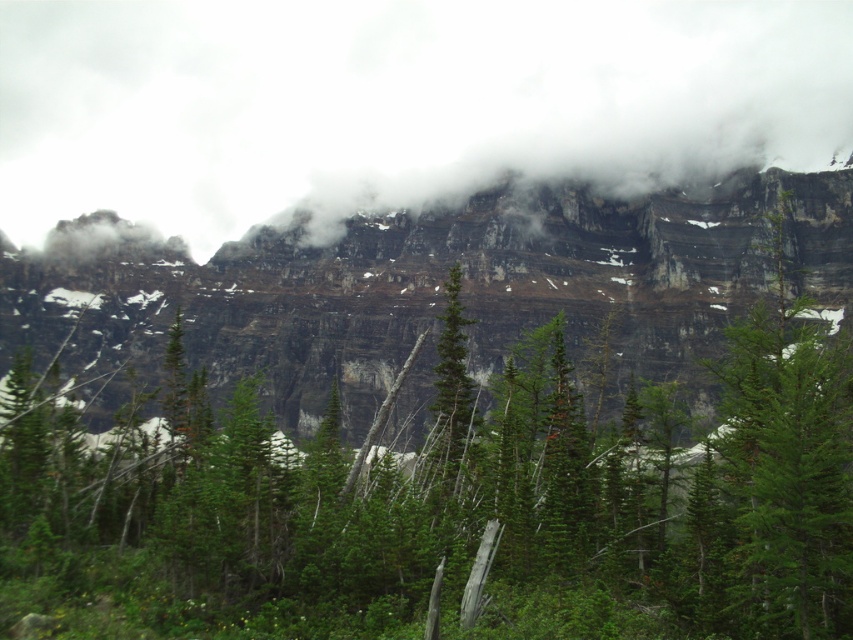
Can you confirm if white fluffy cloud at upper center is taller than rocky cliff at upper center?

Yes.

Is white fluffy cloud at upper center below rocky cliff at upper center?

Incorrect, white fluffy cloud at upper center is not positioned below rocky cliff at upper center.

Measure the distance between white fluffy cloud at upper center and camera.

The distance of white fluffy cloud at upper center from camera is 181.25 meters.

Locate an element on the screen. This screenshot has width=853, height=640. white fluffy cloud at upper center is located at coordinates (396, 102).